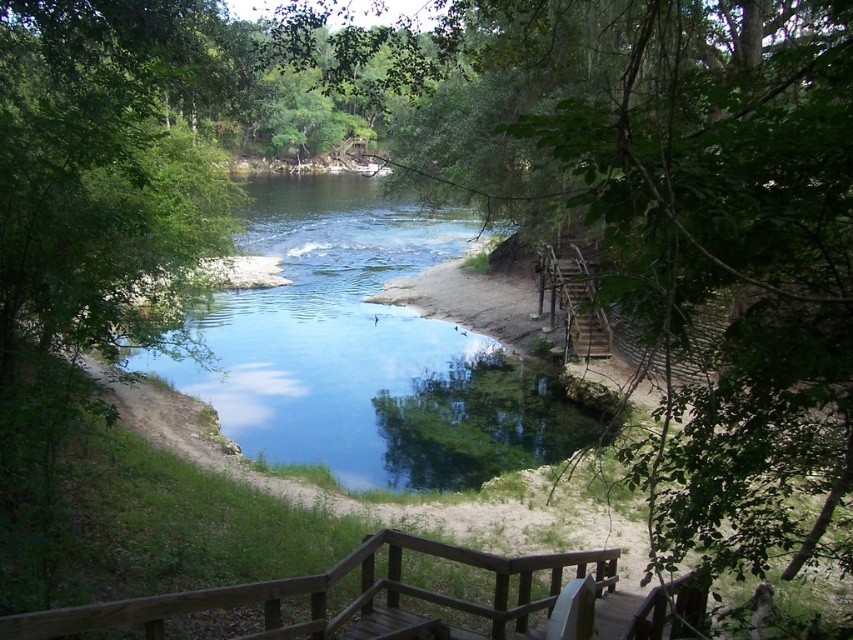
What do you see at coordinates (364, 352) in the screenshot?
I see `clear water at center` at bounding box center [364, 352].

Is point (347, 364) behind point (584, 262)?

That is True.

Where is `clear water at center`? clear water at center is located at coordinates 364,352.